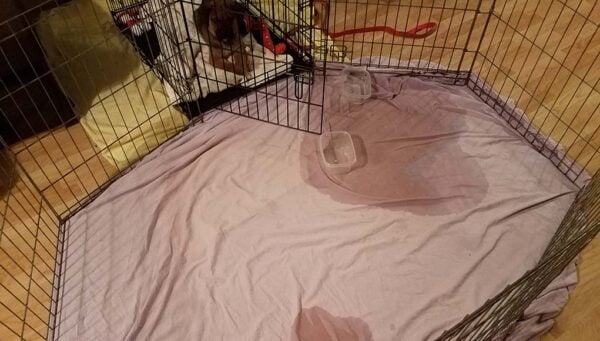
The width and height of the screenshot is (600, 341). In order to click on wire crate in this screenshot , I will do [130, 80].